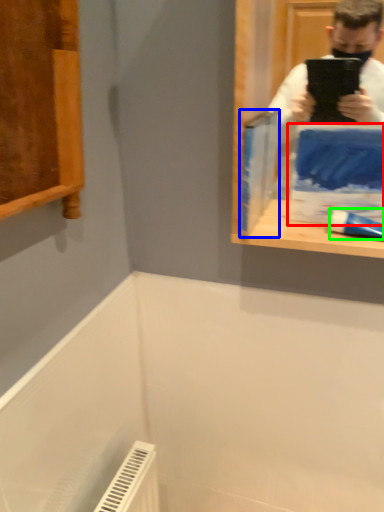
Question: Which object is positioned closest to paperback book (highlighted by a red box)? Select from paperback book (highlighted by a blue box) and toothpaste (highlighted by a green box).

Choices:
 (A) paperback book
 (B) toothpaste

Answer: (B)